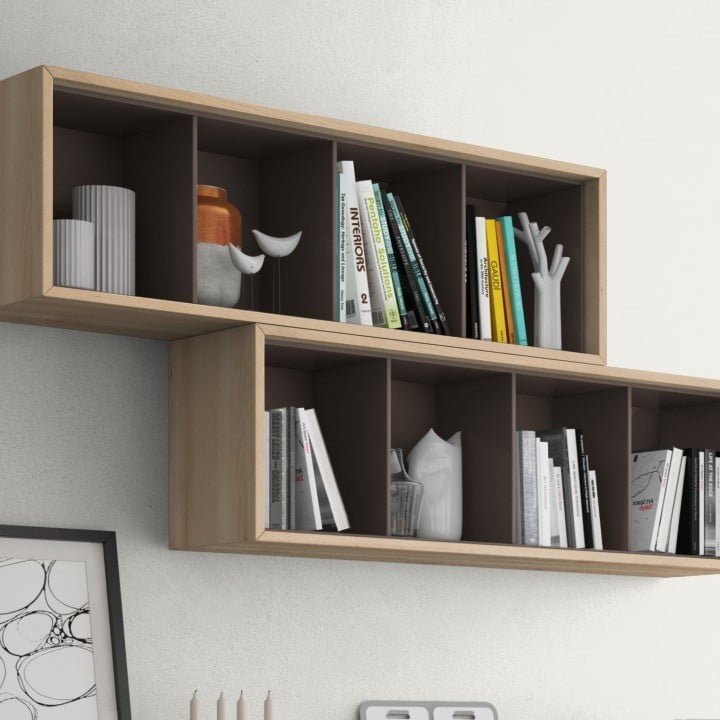
Identify the location of sections of cube shelf. (114, 238), (286, 271), (390, 243), (554, 242), (666, 466), (567, 466), (433, 462), (317, 477), (410, 503).